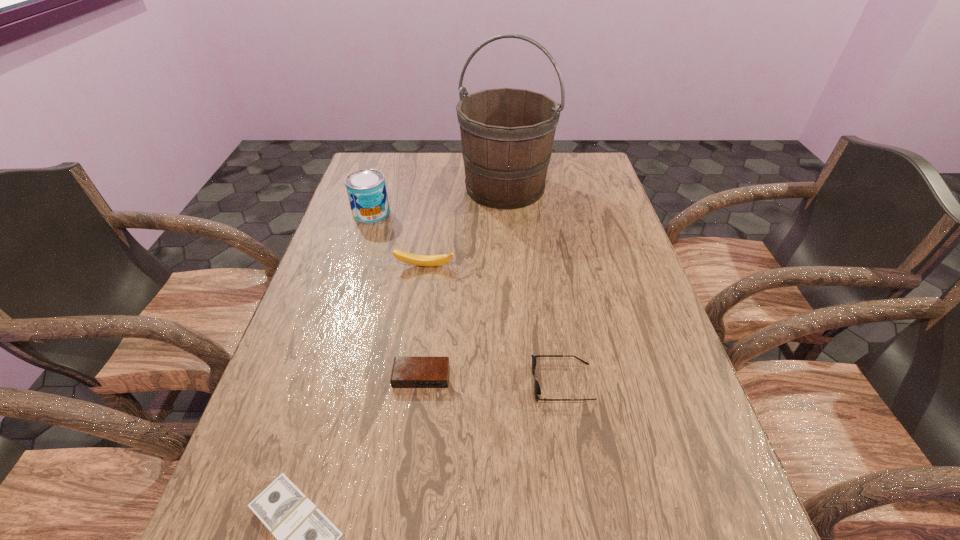
Find the location of `vacant space located on the front-facing side of the sunglasses`. vacant space located on the front-facing side of the sunglasses is located at coordinates (398, 383).

At what (x,y) coordinates should I click in order to perform the action: click on vacant space located 0.150m on the front-facing side of the sunglasses. Please return your answer as a coordinate pair (x, y). Looking at the image, I should click on (461, 383).

Identify the location of vacant space located on the front face of the fifth tallest object. (403, 533).

Image resolution: width=960 pixels, height=540 pixels. What are the coordinates of `object situated at the far edge` in the screenshot? It's located at (507, 134).

This screenshot has height=540, width=960. Find the location of `object present at the left edge`. object present at the left edge is located at coordinates (366, 189).

I want to click on free location at the far edge, so click(551, 175).

The width and height of the screenshot is (960, 540). In the image, there is a desktop. What are the coordinates of `vacant space at the left edge` in the screenshot? It's located at (294, 478).

Locate an element on the screen. The height and width of the screenshot is (540, 960). vacant space at the right edge of the desktop is located at coordinates (607, 226).

Where is `free space at the far left corner`? free space at the far left corner is located at coordinates click(x=389, y=171).

The image size is (960, 540). I want to click on vacant space at the far right corner of the desktop, so click(581, 184).